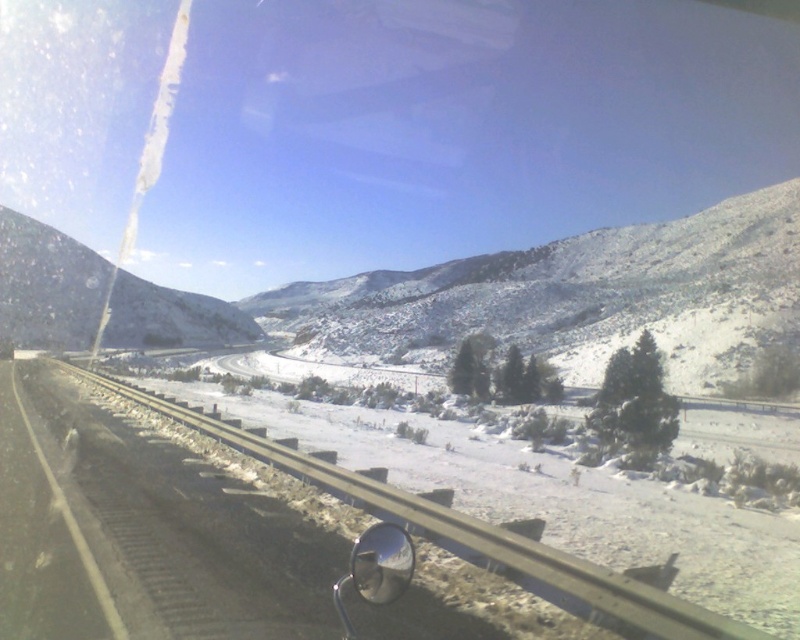
Question: Which of the following is the closest to the observer?

Choices:
 (A) (402, 538)
 (B) (612, 275)

Answer: (A)

Question: Which point is farther to the camera?

Choices:
 (A) (358, 548)
 (B) (88, 257)

Answer: (B)

Question: Does snowy rocky mountain at center have a lesser width compared to glossy metallic view mirror at lower center?

Choices:
 (A) no
 (B) yes

Answer: (A)

Question: Based on their relative distances, which object is farther from the glossy metallic view mirror at lower center?

Choices:
 (A) snowy rocky mountain at left
 (B) snowy rocky mountain at center

Answer: (A)

Question: Is snowy rocky mountain at center positioned in front of snowy rocky mountain at left?

Choices:
 (A) yes
 (B) no

Answer: (A)

Question: Can you confirm if snowy rocky mountain at center is smaller than glossy metallic view mirror at lower center?

Choices:
 (A) yes
 (B) no

Answer: (B)